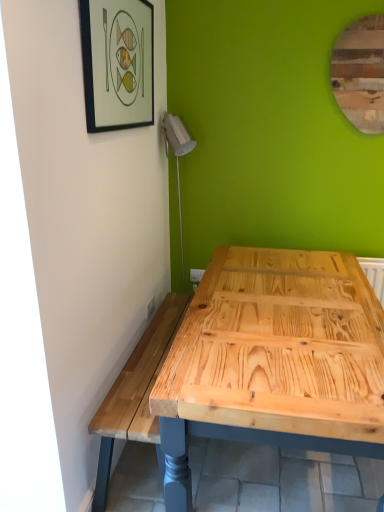
Describe the element at coordinates (360, 73) in the screenshot. I see `wooden mirror at upper right` at that location.

At what (x,y) coordinates should I click in order to perform the action: click on wooden mirror at upper right. Please return your answer as a coordinate pair (x, y). Looking at the image, I should click on (360, 73).

Based on the photo, measure the distance between matte black picture frame at upper left and camera.

A distance of 1.37 meters exists between matte black picture frame at upper left and camera.

What do you see at coordinates (117, 63) in the screenshot? This screenshot has height=512, width=384. I see `matte black picture frame at upper left` at bounding box center [117, 63].

The image size is (384, 512). I want to click on matte black picture frame at upper left, so pos(117,63).

Identify the location of wooden mirror at upper right. (360, 73).

Can you confirm if wooden mirror at upper right is positioned to the right of matte black picture frame at upper left?

Yes.

Does wooden mirror at upper right lie behind matte black picture frame at upper left?

Yes.

Which point is more distant from viewer, (371, 64) or (130, 21)?

Positioned behind is point (371, 64).

From the image's perspective, is wooden mirror at upper right positioned above or below matte black picture frame at upper left?

Clearly, from the image's perspective, wooden mirror at upper right is above matte black picture frame at upper left.

From a real-world perspective, is wooden mirror at upper right above or below matte black picture frame at upper left?

wooden mirror at upper right is above matte black picture frame at upper left.

Can you confirm if wooden mirror at upper right is thinner than matte black picture frame at upper left?

Yes.

Does wooden mirror at upper right have a greater height compared to matte black picture frame at upper left?

Yes, wooden mirror at upper right is taller than matte black picture frame at upper left.

In terms of size, does wooden mirror at upper right appear bigger or smaller than matte black picture frame at upper left?

Clearly, wooden mirror at upper right is smaller in size than matte black picture frame at upper left.

Can we say wooden mirror at upper right lies outside matte black picture frame at upper left?

wooden mirror at upper right is positioned outside matte black picture frame at upper left.

Can you see wooden mirror at upper right touching matte black picture frame at upper left?

There is a gap between wooden mirror at upper right and matte black picture frame at upper left.

Consider the image. Could you tell me if wooden mirror at upper right is facing matte black picture frame at upper left?

No, wooden mirror at upper right is not facing towards matte black picture frame at upper left.

Identify the location of mirror behind the matte black picture frame at upper left. The width and height of the screenshot is (384, 512). (360, 73).

Is matte black picture frame at upper left to the left or to the right of wooden mirror at upper right in the image?

matte black picture frame at upper left is positioned on wooden mirror at upper right's left side.

In the image, is matte black picture frame at upper left positioned in front of or behind wooden mirror at upper right?

Clearly, matte black picture frame at upper left is in front of wooden mirror at upper right.

Is point (92, 108) closer or farther from the camera than point (365, 22)?

Point (92, 108).

From the image's perspective, is matte black picture frame at upper left located above wooden mirror at upper right?

Incorrect, from the image's perspective, matte black picture frame at upper left is lower than wooden mirror at upper right.

From a real-world perspective, is matte black picture frame at upper left above or below wooden mirror at upper right?

matte black picture frame at upper left is situated lower than wooden mirror at upper right in the real world.

Based on the photo, between matte black picture frame at upper left and wooden mirror at upper right, which one has larger width?

Wider between the two is matte black picture frame at upper left.

Can you confirm if matte black picture frame at upper left is taller than wooden mirror at upper right?

No.

Is matte black picture frame at upper left bigger than wooden mirror at upper right?

Yes.

In the scene shown: Choose the correct answer: Is matte black picture frame at upper left inside wooden mirror at upper right or outside it?

The correct answer is: outside.

Is matte black picture frame at upper left far away from wooden mirror at upper right?

Absolutely, matte black picture frame at upper left is distant from wooden mirror at upper right.

Is wooden mirror at upper right at the back of matte black picture frame at upper left?

matte black picture frame at upper left does not have its back to wooden mirror at upper right.

How many degrees apart are the facing directions of matte black picture frame at upper left and wooden mirror at upper right?

The angle between the facing direction of matte black picture frame at upper left and the facing direction of wooden mirror at upper right is 86.6 degrees.

The image size is (384, 512). Find the location of `mirror on the right of matte black picture frame at upper left`. mirror on the right of matte black picture frame at upper left is located at coordinates (360, 73).

Where is `mirror on the right side of matte black picture frame at upper left`? mirror on the right side of matte black picture frame at upper left is located at coordinates (360, 73).

Find the location of a particular element. This screenshot has width=384, height=512. mirror above the matte black picture frame at upper left (from a real-world perspective) is located at coordinates (360, 73).